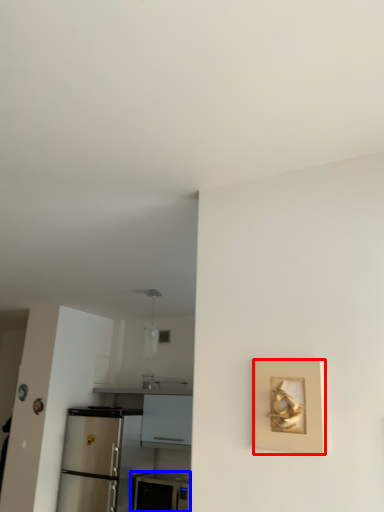
Question: Which object is closer to the camera taking this photo, picture frame (highlighted by a red box) or appliance (highlighted by a blue box)?

Choices:
 (A) picture frame
 (B) appliance

Answer: (A)